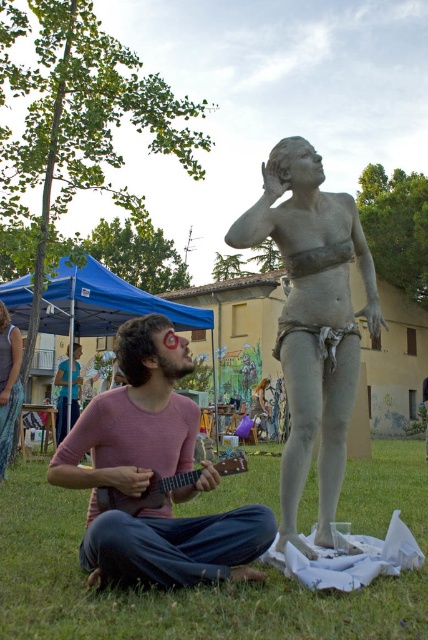
From the picture: You are a photographer trying to capture a shot of the green grass at lower center and the pink cotton shirt at center. Based on their positions, which object is located to the right of the other?

The green grass at lower center is positioned on the right side of pink cotton shirt at center, so the green grass at lower center is to the right of the pink cotton shirt at center.

You are standing at the point marked by the coordinates point (x=208, y=588) in the image. What is the color of the ground under your feet?

The point (x=208, y=588) marks green grass at lower center, so the ground under your feet is green grass.

What are the coordinates of the green grass at lower center in the image?

The green grass at lower center is located at coordinates point (208, 588).